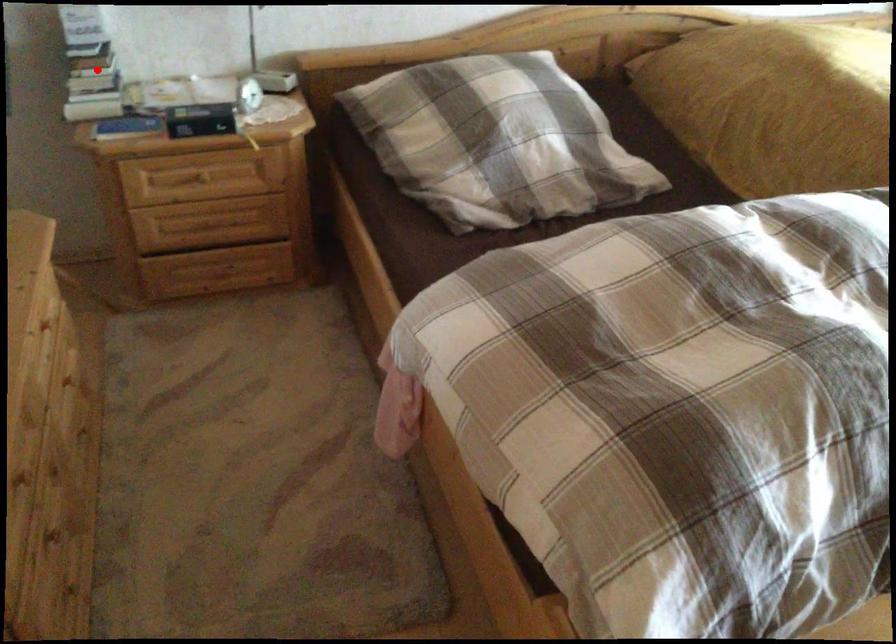
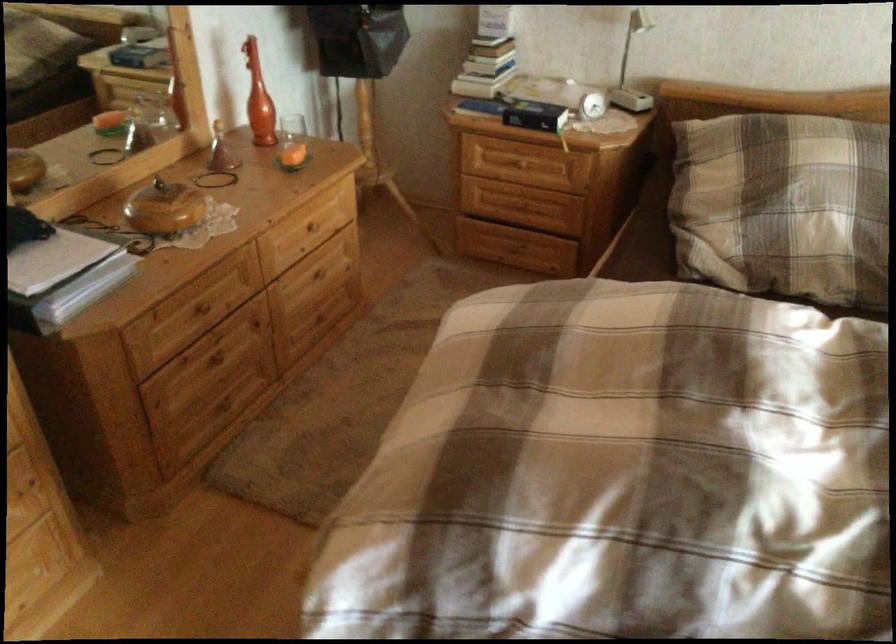
Question: A red point is marked in image1. In image2, is the corresponding 3D point closer to the camera or farther? Reply with the corresponding letter.

Choices:
 (A) The corresponding 3D point is closer.
 (B) The corresponding 3D point is farther.

Answer: (B)